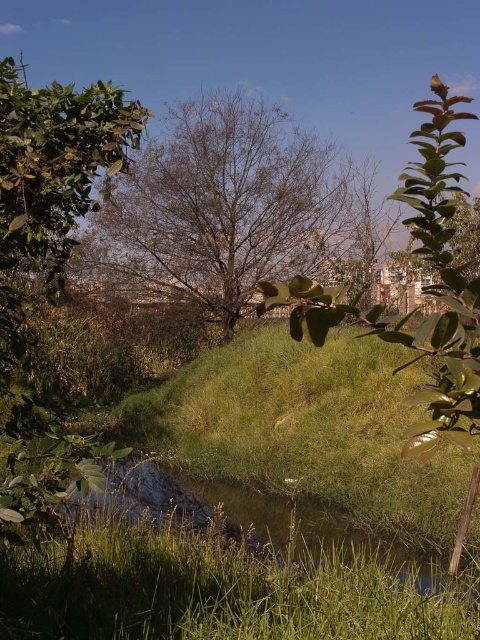
You are standing in the natural scene and want to take a photo of both the green leafy tree at left and the green leafy tree at center. Which tree should you adjust your camera angle to look up or down to include both in the frame?

The green leafy tree at left is located above the green leafy tree at center, so you should adjust your camera angle to look down to include both trees in the frame.

You are a bird flying over the wetland area. You see both the bare branches tree at center and the green leafy tree at center. Which tree would you need to fly over first to reach the urban buildings in the background?

The green leafy tree at center is behind the bare branches tree at center, so you would need to fly over the bare branches tree at center first to reach the urban buildings in the background.

You are standing at the center of the image and want to locate the green leafy tree at left. According to the coordinates provided, in which direction should you look to find it?

The green leafy tree at left is located at coordinates point (47, 275), so you should look to the left side of the image to find it.